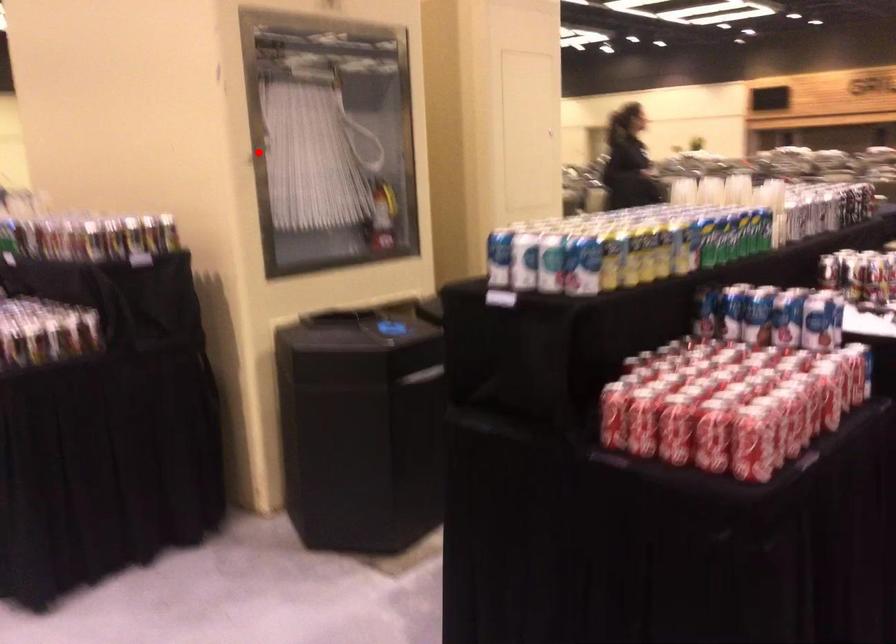
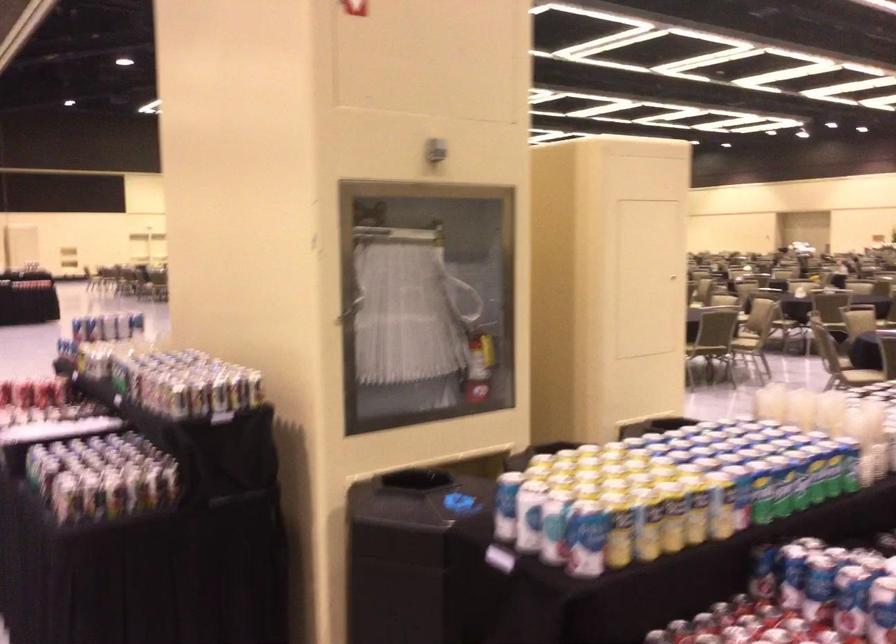
The point at the highlighted location is marked in the first image. Where is the corresponding point in the second image?

(349, 310)